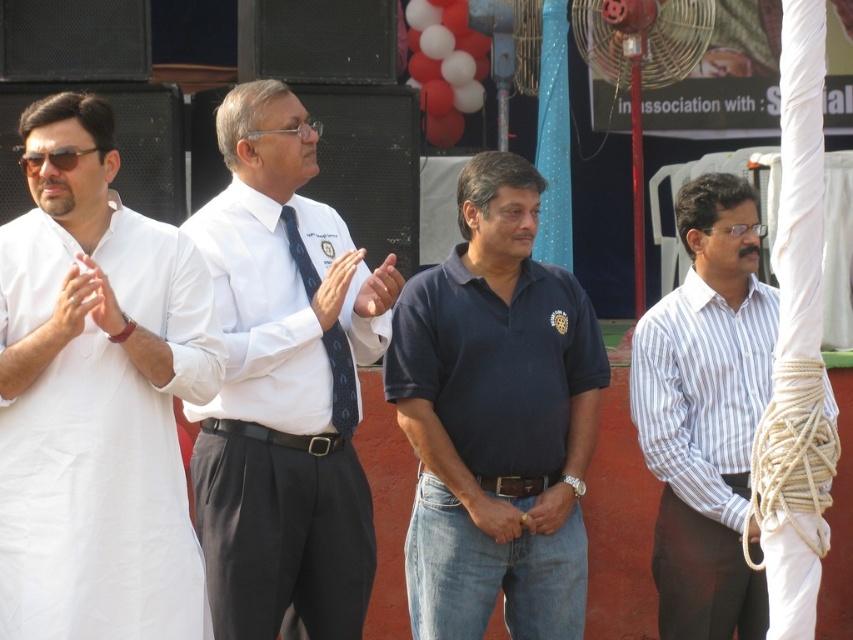
Question: Which object is closer to the camera taking this photo?

Choices:
 (A) dark blue cotton polo shirt at center
 (B) white shirt at center

Answer: (A)

Question: Can you confirm if white cotton kurta at left is positioned to the left of white striped shirt at right?

Choices:
 (A) yes
 (B) no

Answer: (A)

Question: Which object is farther from the camera taking this photo?

Choices:
 (A) matte white hands at left
 (B) dark blue cotton polo shirt at center

Answer: (B)

Question: Is white matte hand at center behind brown leather belt at center?

Choices:
 (A) no
 (B) yes

Answer: (A)

Question: Considering the real-world distances, which object is closest to the matte white hands at left?

Choices:
 (A) white striped shirt at right
 (B) white smooth shirt at center
 (C) white shirt at center

Answer: (B)

Question: Does matte white shirt at center have a smaller size compared to light brown leather hand at center?

Choices:
 (A) yes
 (B) no

Answer: (A)